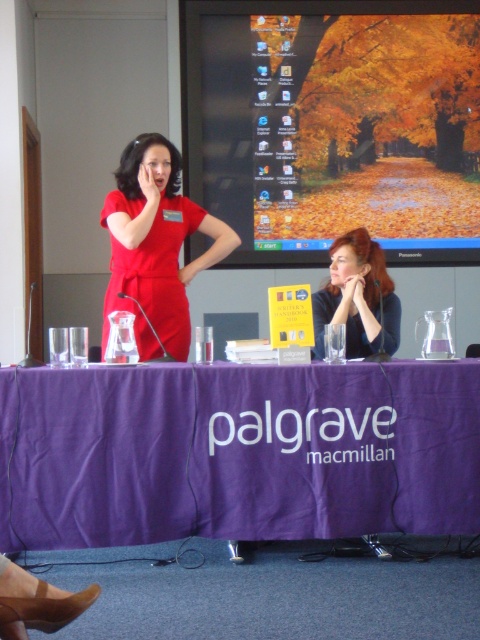
Question: Can you confirm if autumn leaves wallpaper at upper center is positioned above smooth red hair at center?

Choices:
 (A) yes
 (B) no

Answer: (A)

Question: Which object appears farthest from the camera in this image?

Choices:
 (A) matte red dress at center
 (B) smooth red hair at center
 (C) purple fabric table at center

Answer: (B)

Question: Among these points, which one is nearest to the camera?

Choices:
 (A) (169, 339)
 (B) (224, 65)

Answer: (A)

Question: Which point is closer to the camera?

Choices:
 (A) (0, 492)
 (B) (123, 250)

Answer: (A)

Question: Observing the image, what is the correct spatial positioning of purple fabric table at center in reference to matte red dress at center?

Choices:
 (A) right
 (B) left

Answer: (A)

Question: In this image, where is purple fabric table at center located relative to autumn leaves wallpaper at upper center?

Choices:
 (A) right
 (B) left

Answer: (B)